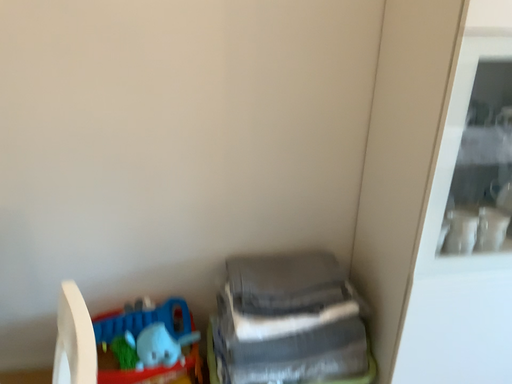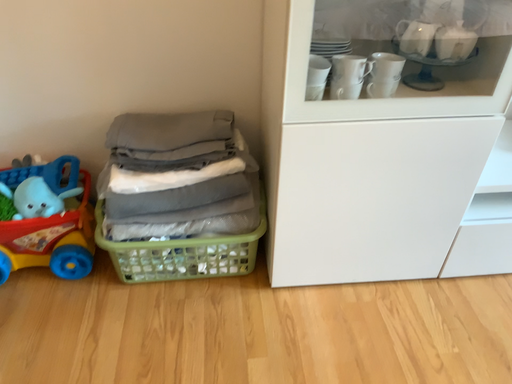
Question: How did the camera likely rotate when shooting the video?

Choices:
 (A) rotated upward
 (B) rotated downward

Answer: (B)